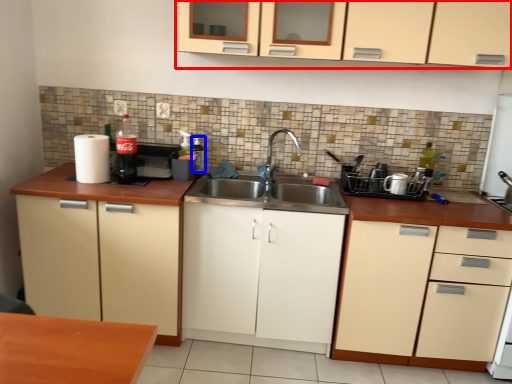
Question: Which object appears farthest to the camera in this image, cabinetry (highlighted by a red box) or bottle (highlighted by a blue box)?

Choices:
 (A) cabinetry
 (B) bottle

Answer: (B)